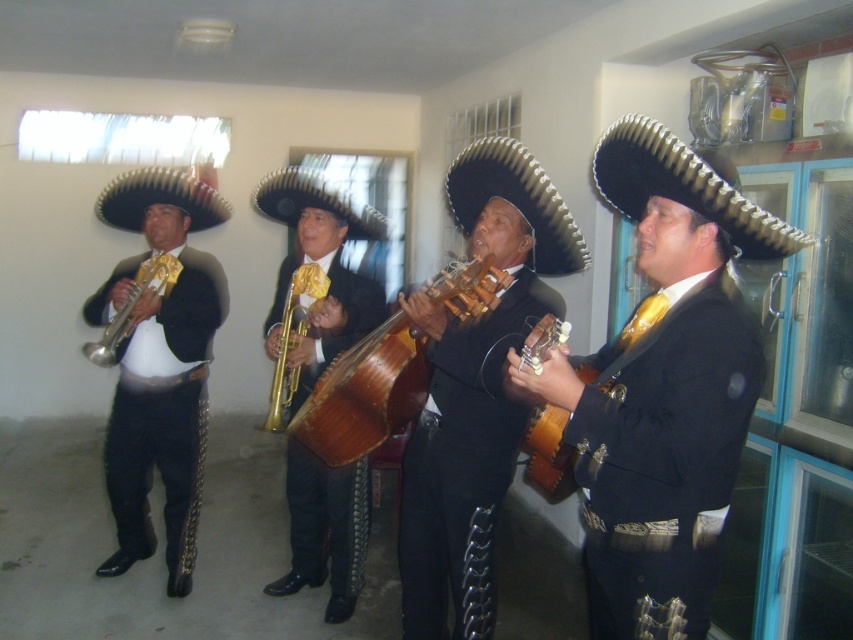
Between point (204, 378) and point (285, 211), which one is positioned in front?

Point (285, 211) is in front.

Who is more distant from viewer, (x=201, y=401) or (x=340, y=502)?

Point (x=201, y=401)

Image resolution: width=853 pixels, height=640 pixels. What do you see at coordinates (160, 364) in the screenshot? I see `matte black trumpet at left` at bounding box center [160, 364].

Find the location of a particular element. matte black trumpet at left is located at coordinates (160, 364).

Is the position of shiny gold trumpet at center less distant than that of shiny brass trumpet at left?

Yes, shiny gold trumpet at center is closer to the viewer.

Between shiny gold trumpet at center and shiny brass trumpet at left, which one is positioned higher?

Positioned higher is shiny brass trumpet at left.

The image size is (853, 640). Identify the location of shiny gold trumpet at center. (320, 268).

Between black straw sombrero at right and black felt sombrero at center, which one has more height?

With more height is black felt sombrero at center.

Which is more to the left, black straw sombrero at right or black felt sombrero at center?

black felt sombrero at center is more to the left.

Between point (622, 205) and point (537, 166), which one is positioned behind?

The point (537, 166) is more distant.

The width and height of the screenshot is (853, 640). What are the coordinates of `black straw sombrero at right` in the screenshot? It's located at (683, 186).